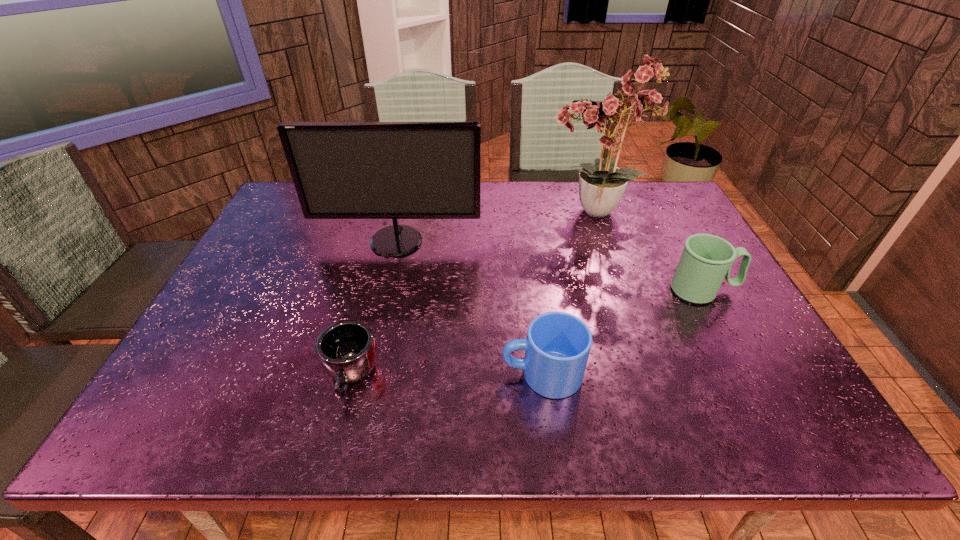
The image size is (960, 540). What are the coordinates of `free space located 0.240m on the front-facing side of the fourth shortest object` in the screenshot? It's located at (378, 321).

Locate an element on the screen. This screenshot has width=960, height=540. free space located 0.200m on the side of the second mug from left to right with the handle is located at coordinates (408, 374).

This screenshot has width=960, height=540. What are the coordinates of `vacant space located 0.240m on the side of the second mug from left to right with the handle` in the screenshot? It's located at (390, 374).

I want to click on free location located on the side of the second mug from left to right with the handle, so click(390, 374).

Where is `object that is at the far edge`? Image resolution: width=960 pixels, height=540 pixels. object that is at the far edge is located at coordinates (601, 185).

Identify the location of flower arrangement positioned at the right edge. This screenshot has height=540, width=960. (601, 185).

Identify the location of mug located in the right edge section of the desktop. The image size is (960, 540). pyautogui.click(x=706, y=260).

Identify the location of object that is at the far right corner. The width and height of the screenshot is (960, 540). (601, 185).

The image size is (960, 540). What are the coordinates of `free space at the far edge` in the screenshot? It's located at (x=487, y=215).

I want to click on free space at the near edge of the desktop, so click(407, 408).